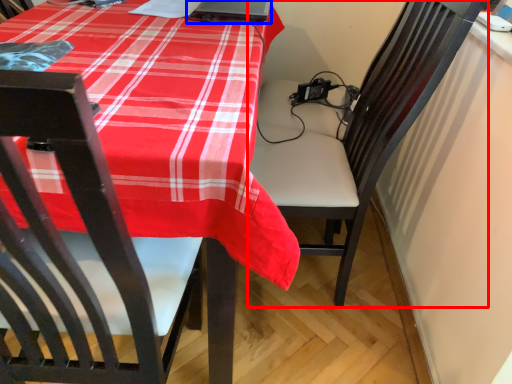
Question: Which object is closer to the camera taking this photo, chair (highlighted by a red box) or laptop (highlighted by a blue box)?

Choices:
 (A) chair
 (B) laptop

Answer: (A)